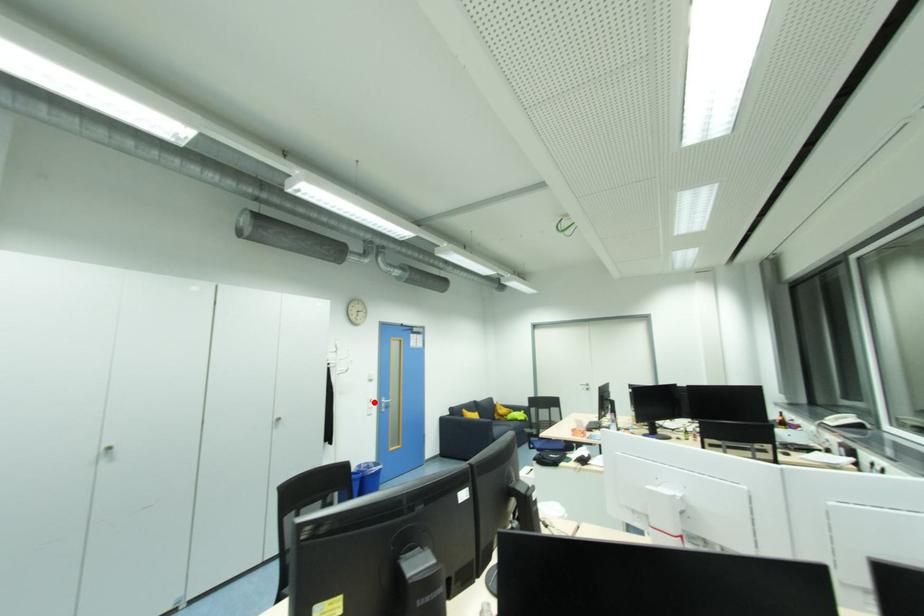
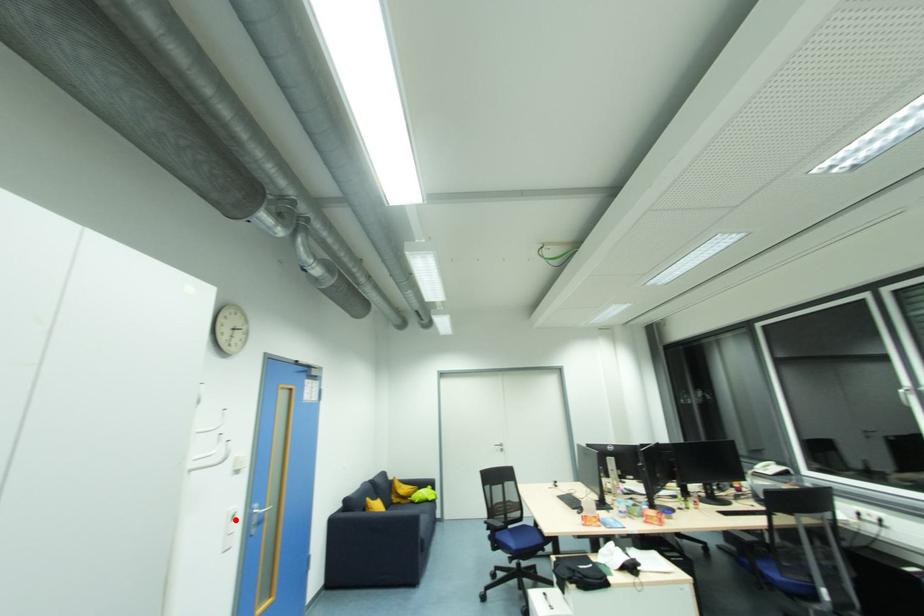
I am providing you with two images of the same scene from different viewpoints. A red point is marked on the first image and another point is marked on the second image. Is the red point in image1 aligned with the point shown in image2?

Yes